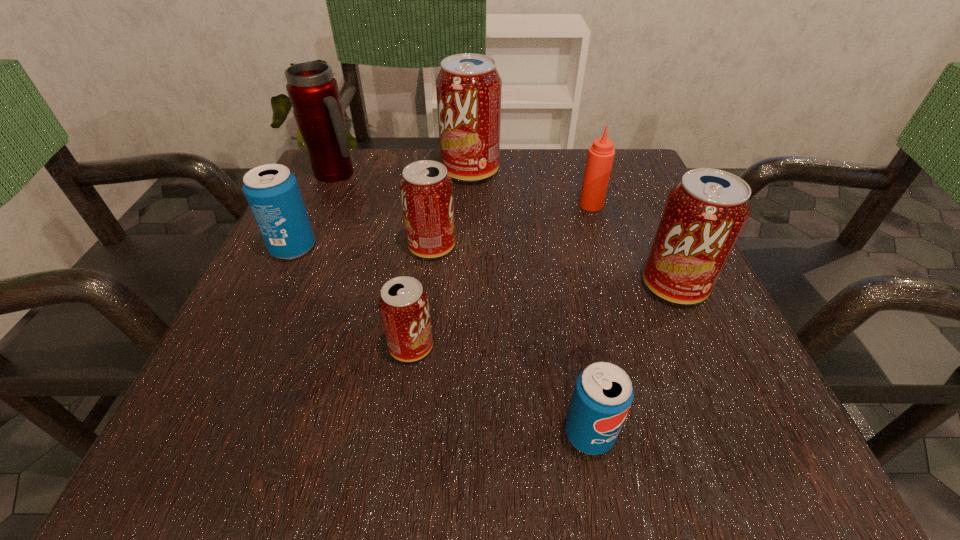
What are the coordinates of `the farthest soda can` in the screenshot? It's located at (468, 87).

Where is `the tallest soda can`? The height and width of the screenshot is (540, 960). the tallest soda can is located at coordinates (468, 87).

The width and height of the screenshot is (960, 540). Identify the location of red thermos bottle. (313, 92).

What are the coordinates of `the rightmost soda can` in the screenshot? It's located at (705, 213).

The image size is (960, 540). What are the coordinates of `the fifth shortest soda can` in the screenshot? It's located at (705, 213).

Where is `the second object from right to left`? The height and width of the screenshot is (540, 960). the second object from right to left is located at coordinates (601, 154).

Where is `the sixth nearest object`? Image resolution: width=960 pixels, height=540 pixels. the sixth nearest object is located at coordinates (601, 154).

Find the location of a particular element. the second farthest red soda can is located at coordinates (426, 190).

Identify the location of the bigger blue soda can. (272, 192).

In order to click on the left blue soda can in this screenshot , I will do `click(272, 192)`.